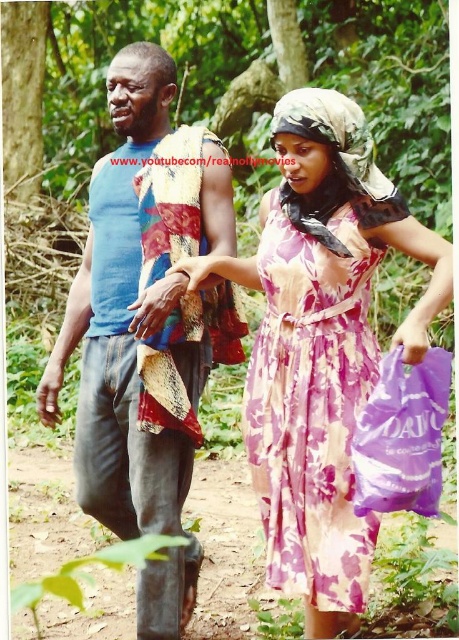
Question: Does floral chiffon dress at center appear on the right side of purple plastic bag at lower right?

Choices:
 (A) no
 (B) yes

Answer: (A)

Question: Which object is positioned farthest from the blue cotton tank top at center?

Choices:
 (A) purple plastic bag at lower right
 (B) floral chiffon dress at center
 (C) matte fabric hand at center
 (D) floral dress at center

Answer: (A)

Question: Estimate the real-world distances between objects in this image. Which object is closer to the blue cotton tank top at center?

Choices:
 (A) purple fabric bag at lower right
 (B) purple plastic bag at lower right
 (C) floral dress at center
 (D) matte fabric hand at center

Answer: (D)

Question: Which object is the farthest from the purple fabric bag at lower right?

Choices:
 (A) purple plastic bag at lower right
 (B) floral chiffon dress at center
 (C) matte fabric hand at center

Answer: (C)

Question: Observing the image, what is the correct spatial positioning of floral dress at center in reference to purple plastic bag at lower right?

Choices:
 (A) above
 (B) below

Answer: (A)

Question: Is purple plastic bag at lower right above matte fabric hand at center?

Choices:
 (A) no
 (B) yes

Answer: (A)